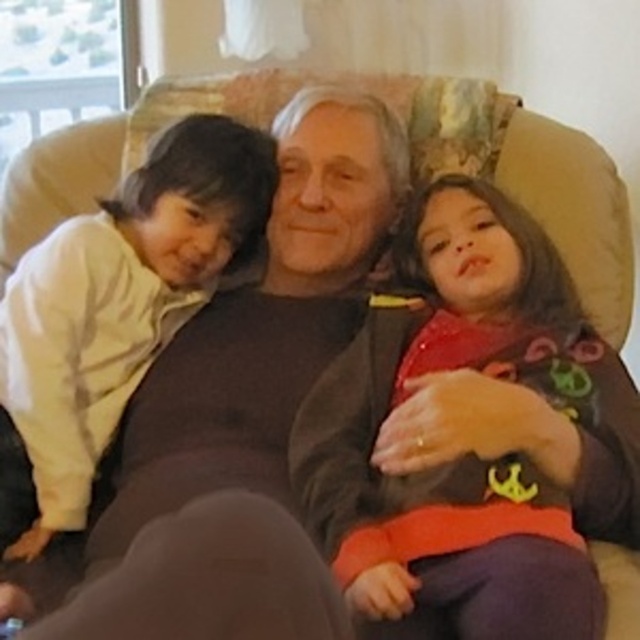
Based on the photo, you are standing in front of the couch and want to place a small gift for each child. The first gift must be placed at point (465, 477) and the second gift at point (196, 198). Which gift will be closer to you when you place them?

The gift placed at point (465, 477) will be closer to you because the point (465, 477) is closer to the viewer than point (196, 198).

You are a photographer trying to capture a family portrait. You notice the matte red sweater at center and the light yellow fleece at left in the scene. Based on their heights, which clothing item should you adjust to ensure both are fully visible in the photo?

The matte red sweater at center is not as tall as the light yellow fleece at left. To ensure both are fully visible, you should lower the camera angle slightly so that the shorter matte red sweater at center is captured without the taller light yellow fleece at left blocking it.

You are a photographer trying to capture a closeup of the matte red sweater at center without including the light yellow fleece at left in the frame. Given their positions, is this possible?

The matte red sweater at center is positioned under the light yellow fleece at left, so it might be possible to angle the camera downward to focus on the sweater while avoiding the fleece above it.